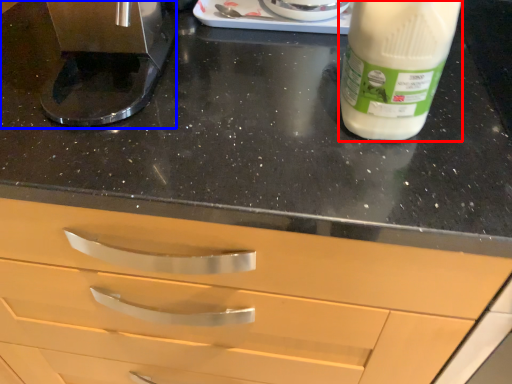
Question: Which of the following is the closest to the observer, yoghurt (highlighted by a red box) or coffee machine (highlighted by a blue box)?

Choices:
 (A) yoghurt
 (B) coffee machine

Answer: (A)